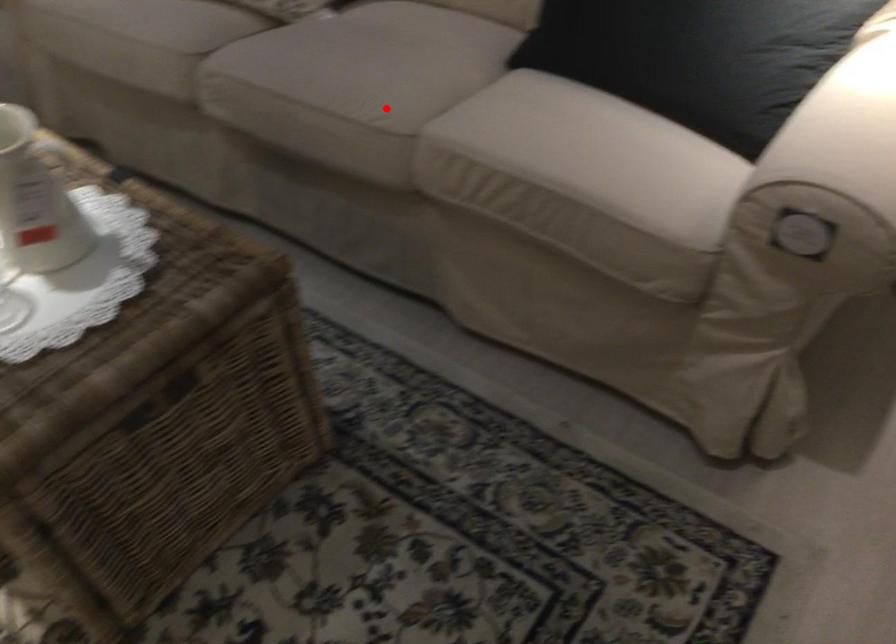
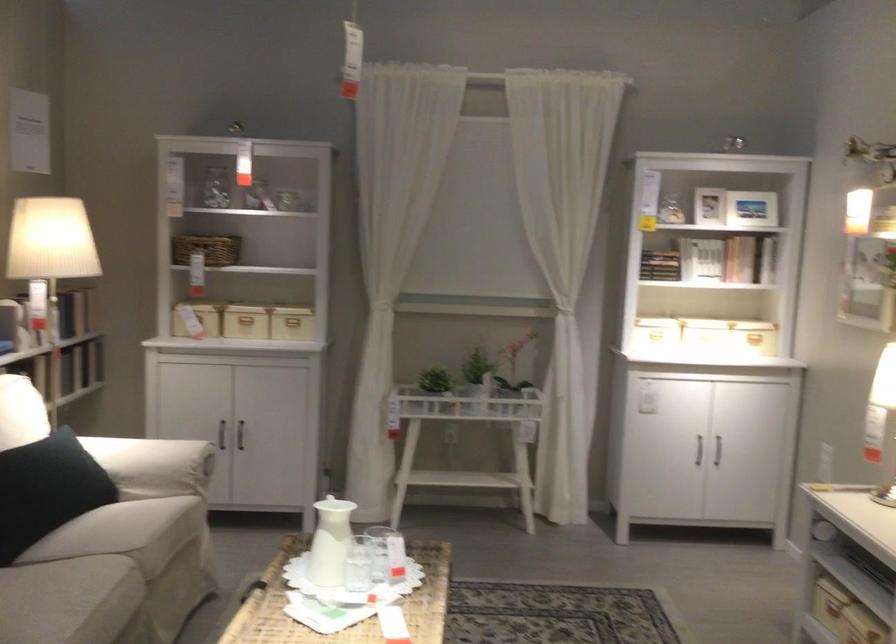
Question: I am providing you with two images of the same scene from different viewpoints. Given a red point in image1, look at the same physical point in image2. Is it:

Choices:
 (A) Closer to the viewpoint
 (B) Farther from the viewpoint

Answer: (B)